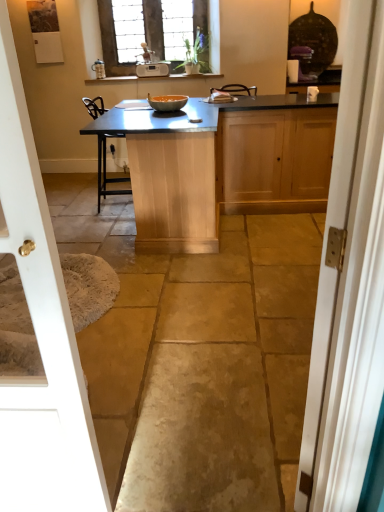
Question: Considering the relative positions of white plastic radio at upper center and translucent glass bowl at center in the image provided, is white plastic radio at upper center behind translucent glass bowl at center?

Choices:
 (A) no
 (B) yes

Answer: (B)

Question: Does white plastic radio at upper center have a lesser height compared to translucent glass bowl at center?

Choices:
 (A) yes
 (B) no

Answer: (B)

Question: Does white plastic radio at upper center have a smaller size compared to translucent glass bowl at center?

Choices:
 (A) yes
 (B) no

Answer: (A)

Question: Is white plastic radio at upper center at the right side of translucent glass bowl at center?

Choices:
 (A) no
 (B) yes

Answer: (A)

Question: Is translucent glass bowl at center completely or partially inside white plastic radio at upper center?

Choices:
 (A) no
 (B) yes

Answer: (A)

Question: From a real-world perspective, is stained glass window at upper center positioned above or below matte silver faucet at upper center?

Choices:
 (A) below
 (B) above

Answer: (B)

Question: Relative to matte silver faucet at upper center, is stained glass window at upper center in front or behind?

Choices:
 (A) behind
 (B) front

Answer: (B)

Question: Is stained glass window at upper center taller or shorter than matte silver faucet at upper center?

Choices:
 (A) short
 (B) tall

Answer: (B)

Question: Is stained glass window at upper center to the left or to the right of matte silver faucet at upper center in the image?

Choices:
 (A) right
 (B) left

Answer: (A)

Question: Relative to white glossy door at left, the first door in the left-to-right sequence, is white plastic radio at upper center in front or behind?

Choices:
 (A) behind
 (B) front

Answer: (A)

Question: From their relative heights in the image, would you say white plastic radio at upper center is taller or shorter than white glossy door at left, the first door in the left-to-right sequence?

Choices:
 (A) short
 (B) tall

Answer: (A)

Question: In terms of size, does white plastic radio at upper center appear bigger or smaller than white glossy door at left, placed as the second door when sorted from right to left?

Choices:
 (A) big
 (B) small

Answer: (B)

Question: Visually, is white plastic radio at upper center positioned to the left or to the right of white glossy door at left, the first door in the left-to-right sequence?

Choices:
 (A) right
 (B) left

Answer: (A)

Question: In terms of height, does matte wood cabinet at right, which is counted as the 2th cabinetry, starting from the left, look taller or shorter compared to white painted wood door at right, arranged as the 1th door when viewed from the right?

Choices:
 (A) tall
 (B) short

Answer: (B)

Question: From the image's perspective, is matte wood cabinet at right, which is counted as the 2th cabinetry, starting from the left, located above or below white painted wood door at right, arranged as the 1th door when viewed from the right?

Choices:
 (A) below
 (B) above

Answer: (B)